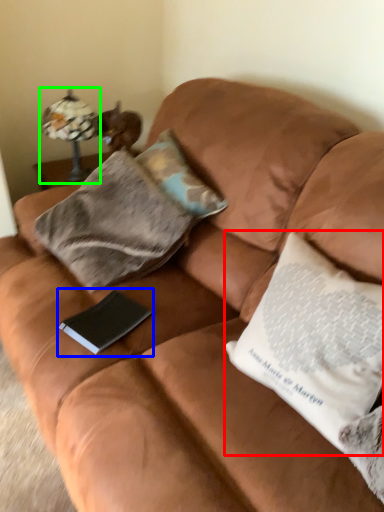
Question: Based on their relative distances, which object is farther from pillow (highlighted by a red box)? Choose from paperback book (highlighted by a blue box) and lamp (highlighted by a green box).

Choices:
 (A) paperback book
 (B) lamp

Answer: (B)